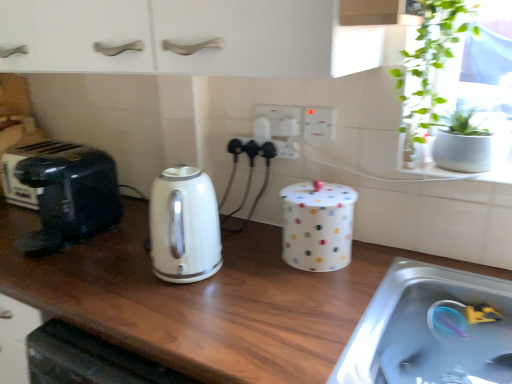
Question: Is white glossy electric kettle at center taller than white polka dot container at center, marked as the second appliance in a back-to-front arrangement?

Choices:
 (A) yes
 (B) no

Answer: (A)

Question: Can you confirm if white glossy electric kettle at center is wider than white polka dot container at center, which appears as the 2th appliance when viewed from the left?

Choices:
 (A) yes
 (B) no

Answer: (A)

Question: Is white glossy electric kettle at center oriented towards white polka dot container at center, the first appliance positioned from the right?

Choices:
 (A) no
 (B) yes

Answer: (A)

Question: Can you confirm if white glossy electric kettle at center is positioned to the right of white polka dot container at center, the first appliance positioned from the right?

Choices:
 (A) yes
 (B) no

Answer: (B)

Question: From the image's perspective, does white glossy electric kettle at center appear higher than white polka dot container at center, acting as the first appliance starting from the front?

Choices:
 (A) yes
 (B) no

Answer: (B)

Question: From the image's perspective, is wooden at center positioned above or below white plastic electrical outlet at center, the third electric outlet positioned from the left?

Choices:
 (A) above
 (B) below

Answer: (B)

Question: Relative to white plastic electrical outlet at center, the 1th electric outlet viewed from the right, is wooden at center in front or behind?

Choices:
 (A) behind
 (B) front

Answer: (B)

Question: Based on their sizes in the image, would you say wooden at center is bigger or smaller than white plastic electrical outlet at center, the 1th electric outlet viewed from the right?

Choices:
 (A) small
 (B) big

Answer: (B)

Question: In the image, is wooden at center on the left side or the right side of white plastic electrical outlet at center, the 1th electric outlet viewed from the right?

Choices:
 (A) right
 (B) left

Answer: (B)

Question: Does point (316, 124) appear closer or farther from the camera than point (290, 132)?

Choices:
 (A) closer
 (B) farther

Answer: (A)

Question: Considering the positions of white plastic electrical outlet at center, the 1th electric outlet viewed from the right, and white plastic electric outlet at center, which is the 2th electric outlet in right-to-left order, in the image, is white plastic electrical outlet at center, the 1th electric outlet viewed from the right, wider or thinner than white plastic electric outlet at center, which is the 2th electric outlet in right-to-left order,?

Choices:
 (A) wide
 (B) thin

Answer: (A)

Question: Considering their positions, is white plastic electrical outlet at center, the 1th electric outlet viewed from the right, located in front of or behind white plastic electric outlet at center, the 2th electric outlet positioned from the left?

Choices:
 (A) front
 (B) behind

Answer: (A)

Question: Based on their positions, is white plastic electrical outlet at center, the 1th electric outlet viewed from the right, located to the left or right of white plastic electric outlet at center, the 2th electric outlet positioned from the left?

Choices:
 (A) left
 (B) right

Answer: (B)

Question: Considering the positions of white plastic electrical outlet at center, the 1th electric outlet viewed from the right, and white polka dot container at center, acting as the first appliance starting from the front, in the image, is white plastic electrical outlet at center, the 1th electric outlet viewed from the right, taller or shorter than white polka dot container at center, acting as the first appliance starting from the front,?

Choices:
 (A) short
 (B) tall

Answer: (A)

Question: Looking at the image, does white plastic electrical outlet at center, the 1th electric outlet viewed from the right, seem bigger or smaller compared to white polka dot container at center, marked as the second appliance in a back-to-front arrangement?

Choices:
 (A) small
 (B) big

Answer: (A)